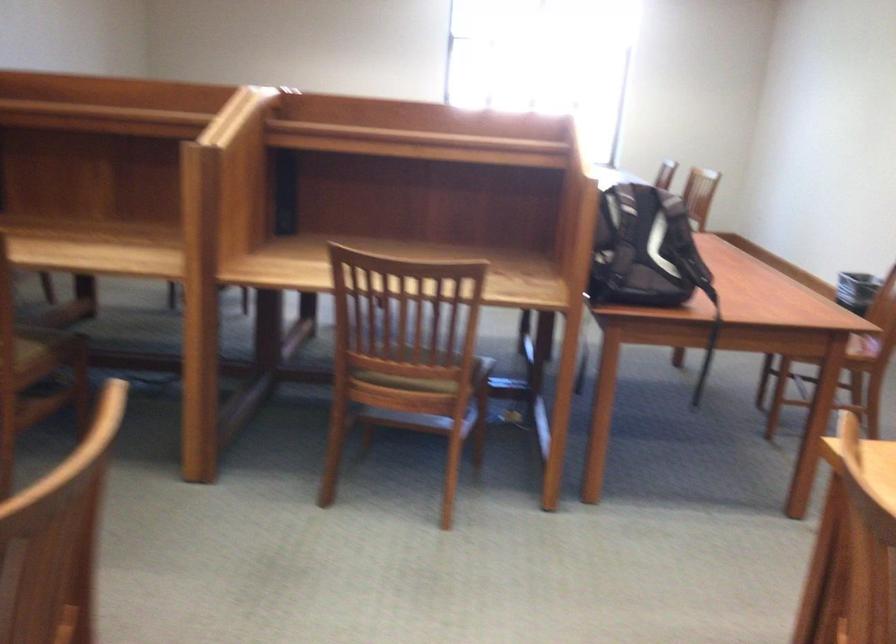
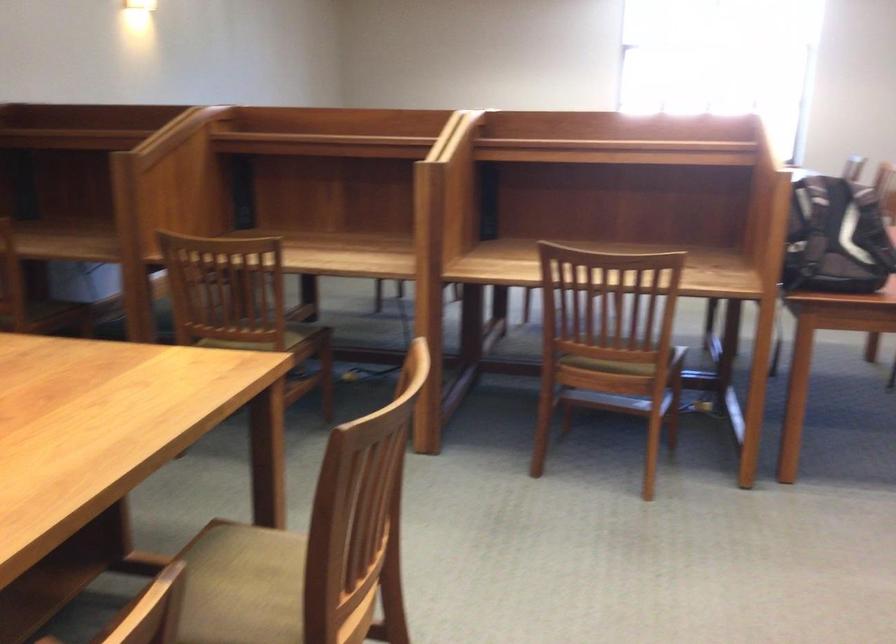
Question: The images are taken continuously from a first-person perspective. In which direction are you moving?

Choices:
 (A) Left
 (B) Right
 (C) Forward
 (D) Backward

Answer: (D)